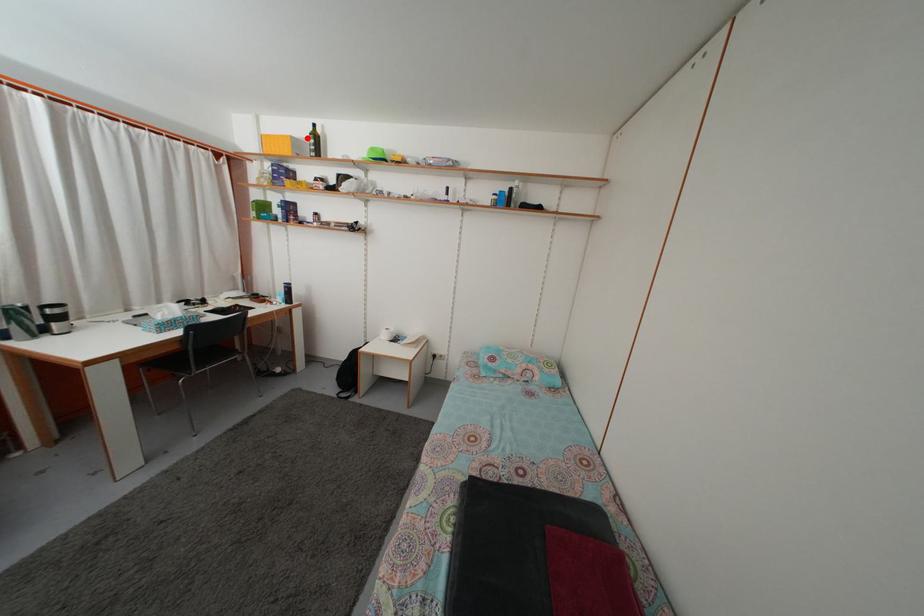
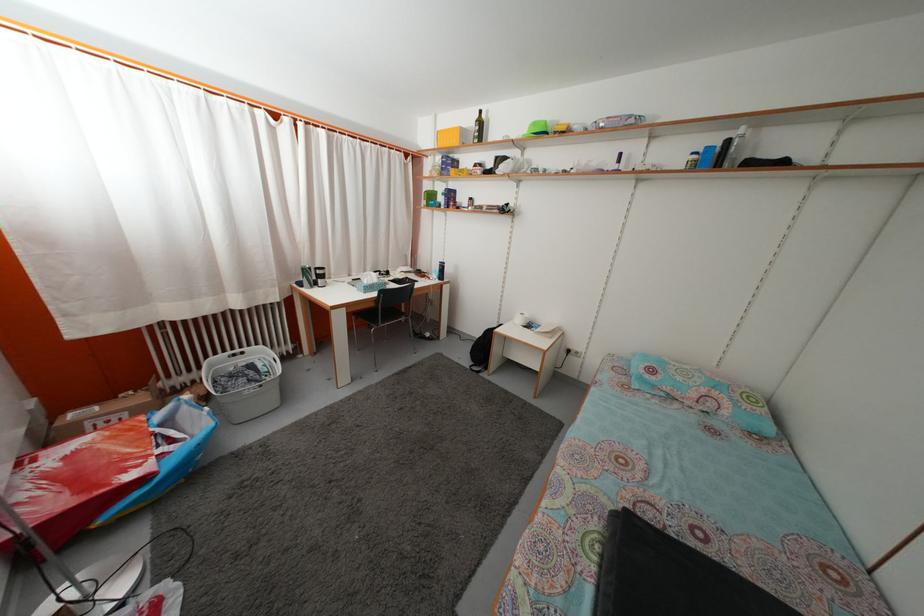
Question: I am providing you with two images of the same scene from different viewpoints. A red point is marked on the first image. At the location where the point appears in image 1, is it still visible in image 2?

Choices:
 (A) Yes
 (B) No

Answer: (A)